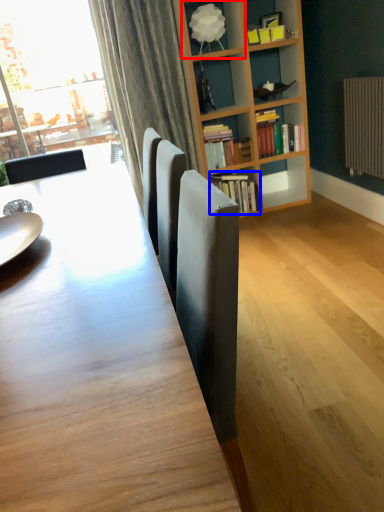
Question: Which of the following is the farthest to the observer, shelf (highlighted by a red box) or book (highlighted by a blue box)?

Choices:
 (A) shelf
 (B) book

Answer: (B)